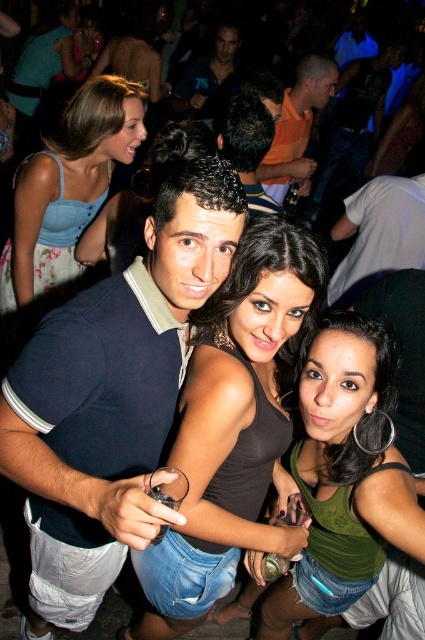
Which of these two, white cotton shirt at upper right or dark brown hair at center, stands shorter?

With less height is dark brown hair at center.

Between point (405, 257) and point (260, 106), which one is positioned behind?

Positioned behind is point (405, 257).

Locate an element on the screen. This screenshot has width=425, height=640. white cotton shirt at upper right is located at coordinates (379, 230).

Which is more to the right, denim dress at upper left or dark brown hair at center?

From the viewer's perspective, dark brown hair at center appears more on the right side.

Between denim dress at upper left and dark brown hair at center, which one is positioned higher?

dark brown hair at center

The height and width of the screenshot is (640, 425). Describe the element at coordinates (68, 186) in the screenshot. I see `denim dress at upper left` at that location.

I want to click on denim dress at upper left, so click(68, 186).

Is dark blue polo shirt at center positioned at the back of white cotton shirt at upper right?

No, dark blue polo shirt at center is closer to the viewer.

Can you confirm if dark blue polo shirt at center is smaller than white cotton shirt at upper right?

No, dark blue polo shirt at center is not smaller than white cotton shirt at upper right.

Who is more distant from viewer, (234, 184) or (371, 260)?

Positioned behind is point (371, 260).

The height and width of the screenshot is (640, 425). What are the coordinates of `dark blue polo shirt at center` in the screenshot? It's located at [x=112, y=396].